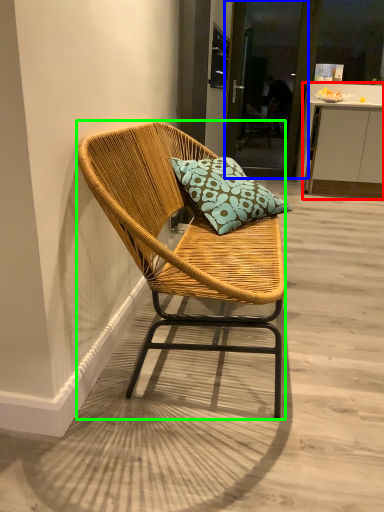
Question: Based on their relative distances, which object is nearer to cabinetry (highlighted by a red box)? Choose from screen door (highlighted by a blue box) and chair (highlighted by a green box).

Choices:
 (A) screen door
 (B) chair

Answer: (A)